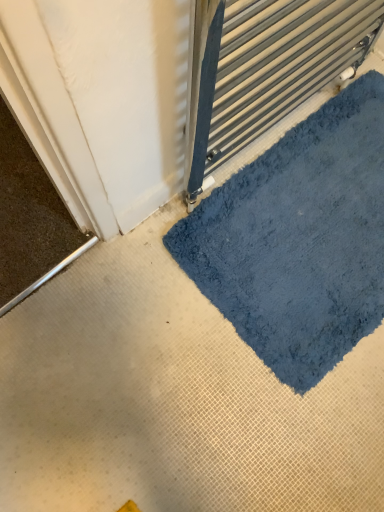
This screenshot has height=512, width=384. Describe the element at coordinates (299, 239) in the screenshot. I see `blue shaggy bath mat at lower right` at that location.

At what (x,y) coordinates should I click in order to perform the action: click on blue shaggy bath mat at lower right. Please return your answer as a coordinate pair (x, y). Looking at the image, I should click on (299, 239).

Locate an element on the screen. This screenshot has width=384, height=512. blue shaggy bath mat at lower right is located at coordinates (299, 239).